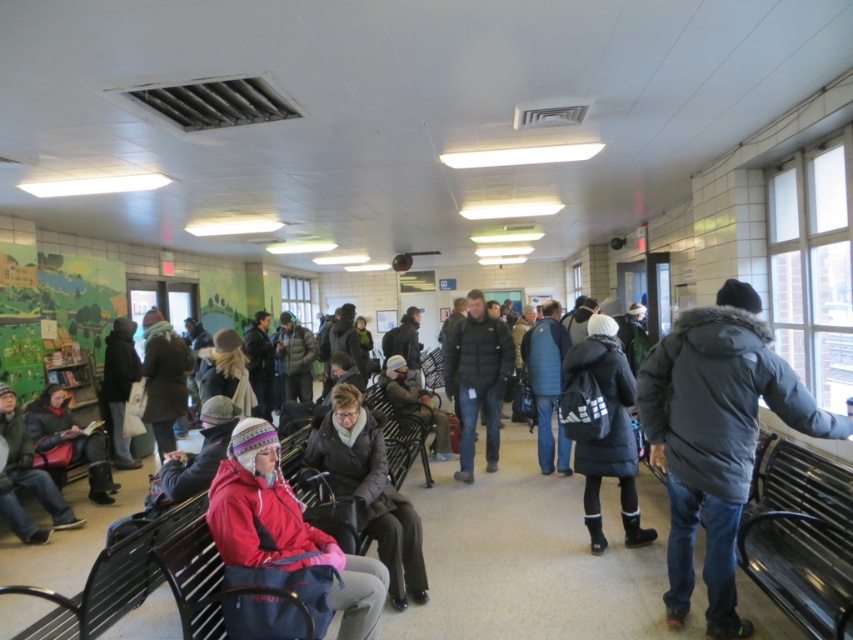
Question: Does matte red jacket at lower left have a lesser width compared to matte black jacket at center?

Choices:
 (A) yes
 (B) no

Answer: (A)

Question: Is black matte backpack at center above red knit hat at center?

Choices:
 (A) no
 (B) yes

Answer: (B)

Question: Which of the following is the farthest from the observer?

Choices:
 (A) (119, 536)
 (B) (28, 413)
 (C) (463, 324)
 (D) (405, 566)

Answer: (C)

Question: Where is dark gray fur-lined coat at right located in relation to blue fabric jacket at center in the image?

Choices:
 (A) right
 (B) left

Answer: (A)

Question: Considering the real-world distances, which object is farthest from the dark gray knit hat at center?

Choices:
 (A) dark brown leather jacket at center
 (B) metallic black bench at center
 (C) black matte backpack at center
 (D) matte red jacket at lower left

Answer: (C)

Question: Estimate the real-world distances between objects in this image. Which object is farther from the metallic black bench at center?

Choices:
 (A) matte black jacket at lower left
 (B) dark gray knit hat at center
 (C) metallic silver bench at lower right

Answer: (A)